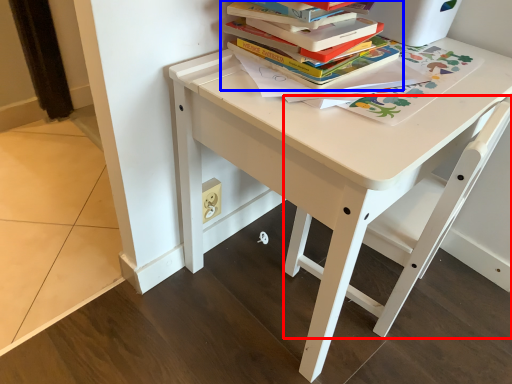
Question: Which of the following is the farthest to the observer, chair (highlighted by a red box) or book (highlighted by a blue box)?

Choices:
 (A) chair
 (B) book

Answer: (B)